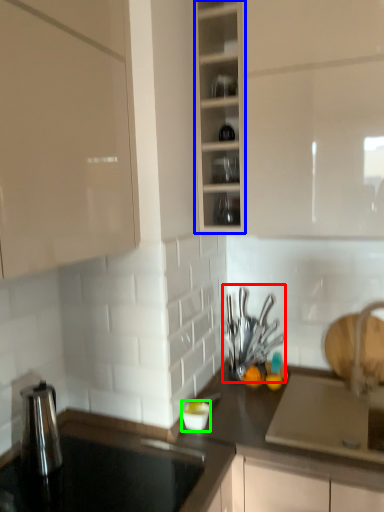
Question: Which is nearer to the tableware (highlighted by a red box)? cabinetry (highlighted by a blue box) or tableware (highlighted by a green box).

Choices:
 (A) cabinetry
 (B) tableware

Answer: (B)